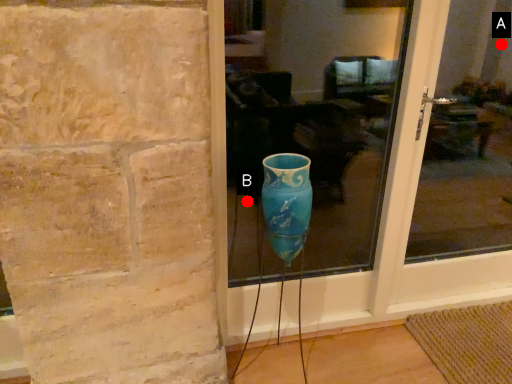
Question: Two points are circled on the image, labeled by A and B beside each circle. Which point is farther to the camera?

Choices:
 (A) A is further
 (B) B is further

Answer: (A)